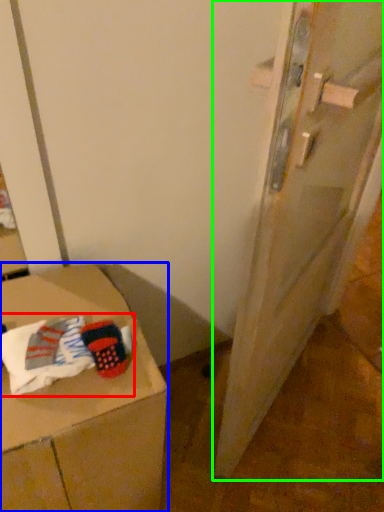
Question: Estimate the real-world distances between objects in this image. Which object is farther from laundry (highlighted by a red box), furniture (highlighted by a blue box) or door (highlighted by a green box)?

Choices:
 (A) furniture
 (B) door

Answer: (B)